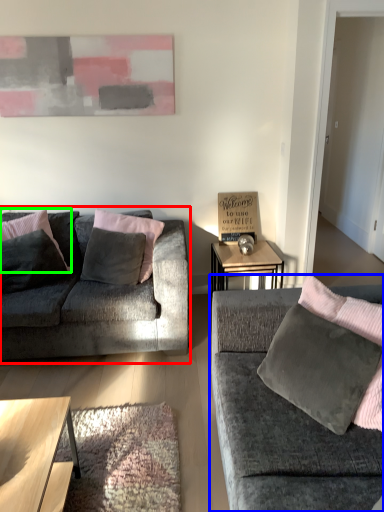
Question: Estimate the real-world distances between objects in this image. Which object is farther from studio couch (highlighted by a red box), studio couch (highlighted by a blue box) or pillow (highlighted by a green box)?

Choices:
 (A) studio couch
 (B) pillow

Answer: (A)